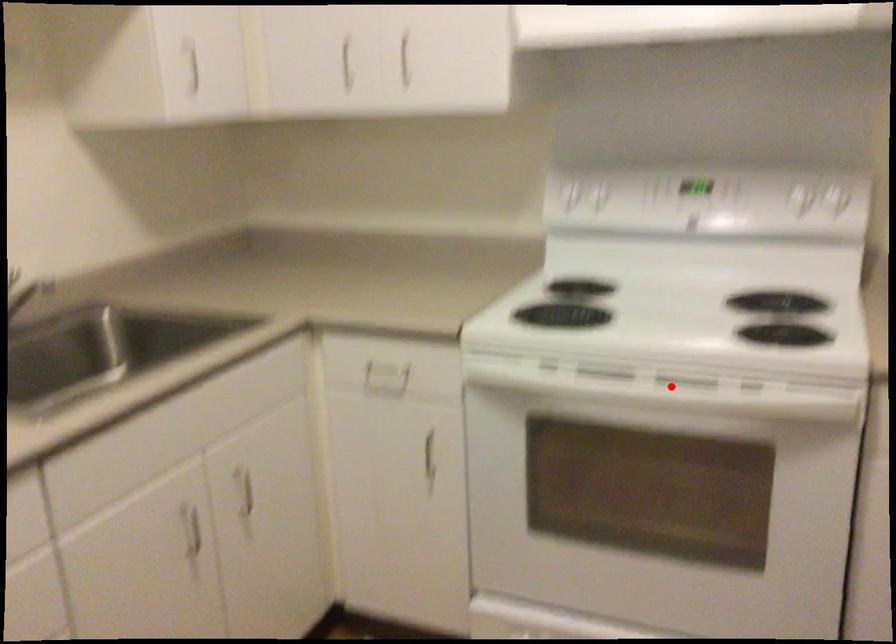
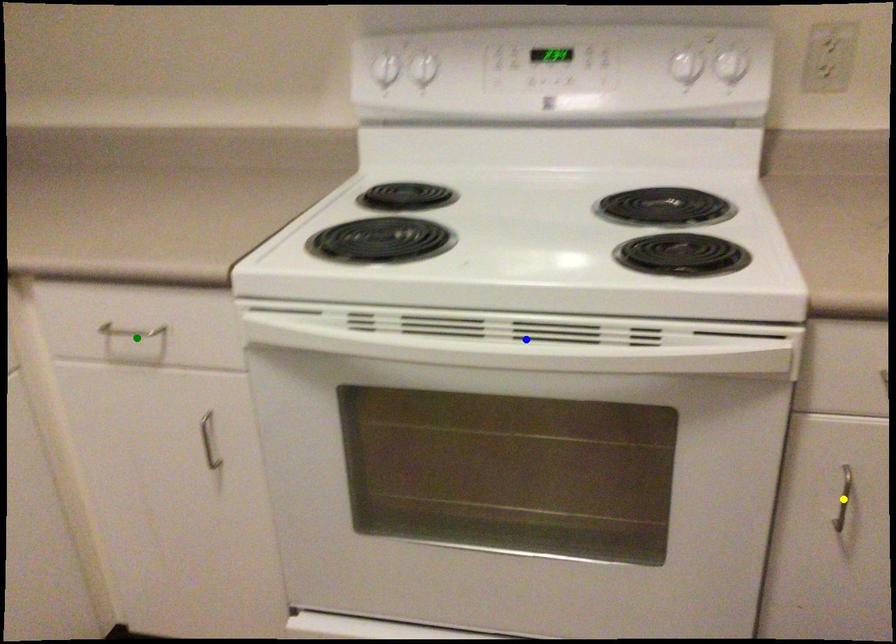
Question: I am providing you with two images of the same scene from different viewpoints. A red point is marked on the first image. You are given multiple points on the second image. Which spot in image 2 lines up with the point in image 1?

Choices:
 (A) green point
 (B) blue point
 (C) yellow point

Answer: (B)